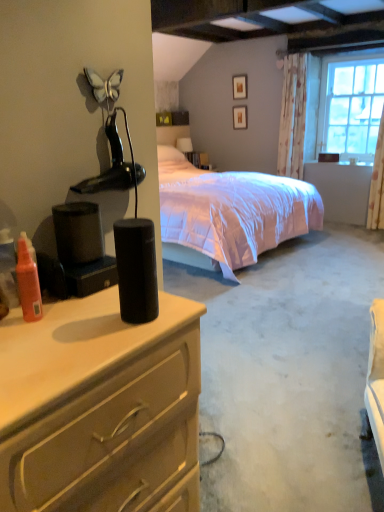
Where is `free point above matte black speaker at left (from a real-world perspective)`? free point above matte black speaker at left (from a real-world perspective) is located at coordinates (x=63, y=326).